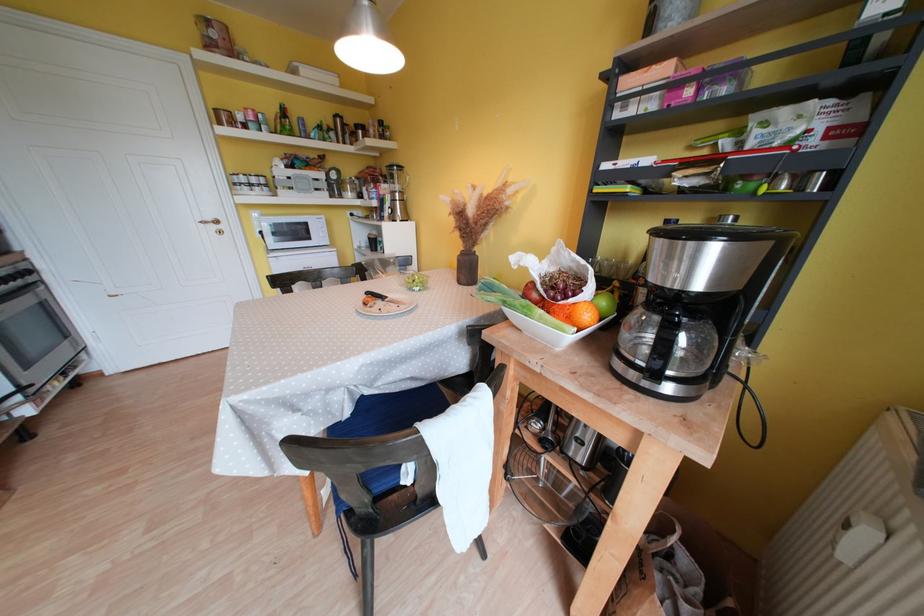
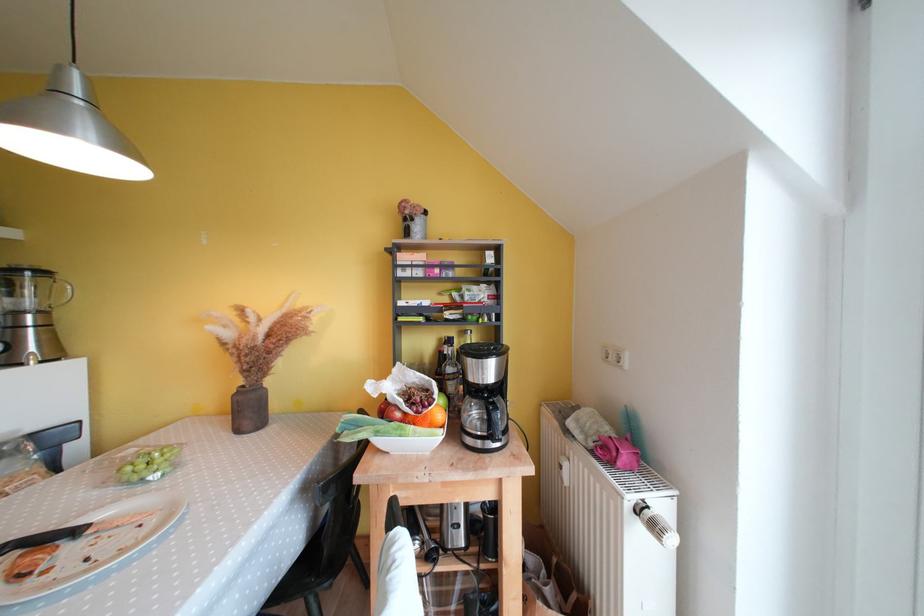
In the second image, find the point that corresponds to point (854, 530) in the first image.

(566, 471)